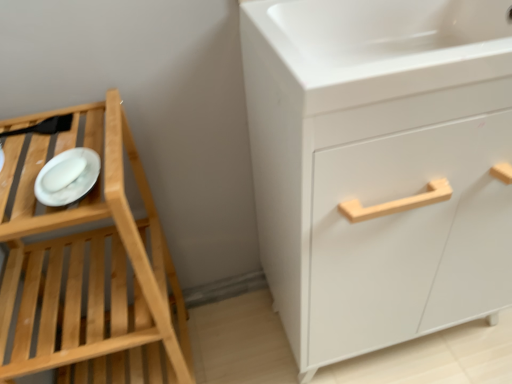
Question: Is white matte platter at left in front of or behind white glossy sink at upper right in the image?

Choices:
 (A) front
 (B) behind

Answer: (A)

Question: From the image's perspective, is white matte platter at left positioned above or below white glossy sink at upper right?

Choices:
 (A) above
 (B) below

Answer: (B)

Question: Estimate the real-world distances between objects in this image. Which object is farther from the white glossy sink at upper right?

Choices:
 (A) white matte cabinet at right
 (B) white matte platter at left
 (C) natural wood tray at left

Answer: (C)

Question: Estimate the real-world distances between objects in this image. Which object is farther from the white matte cabinet at right?

Choices:
 (A) white matte platter at left
 (B) natural wood tray at left
 (C) white glossy sink at upper right

Answer: (A)